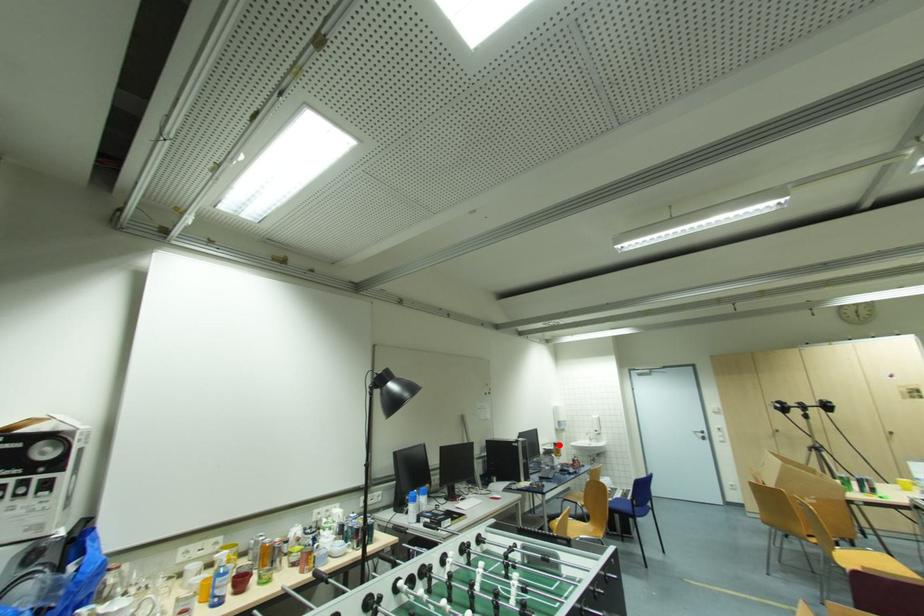
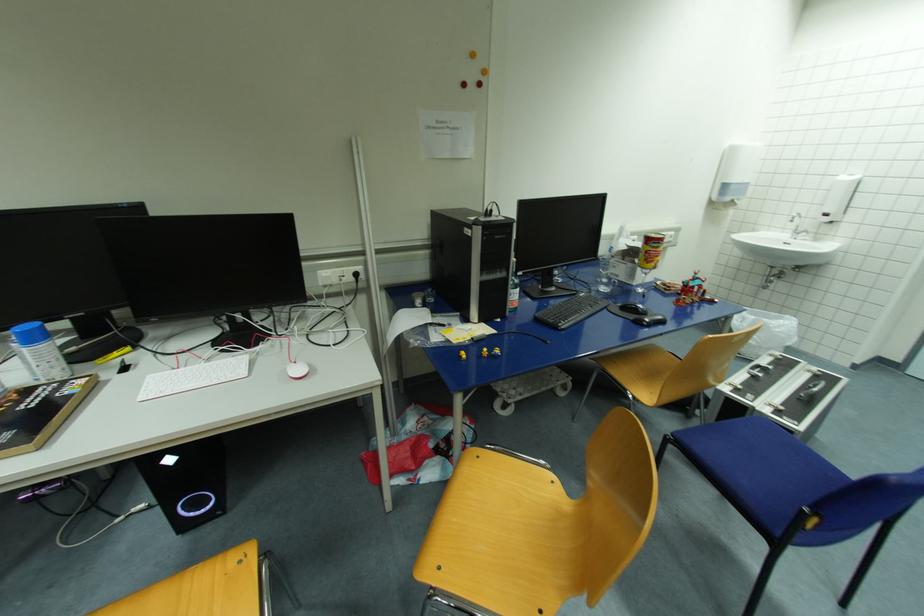
In the second image, find the point that corresponds to the highlighted location in the first image.

(653, 241)